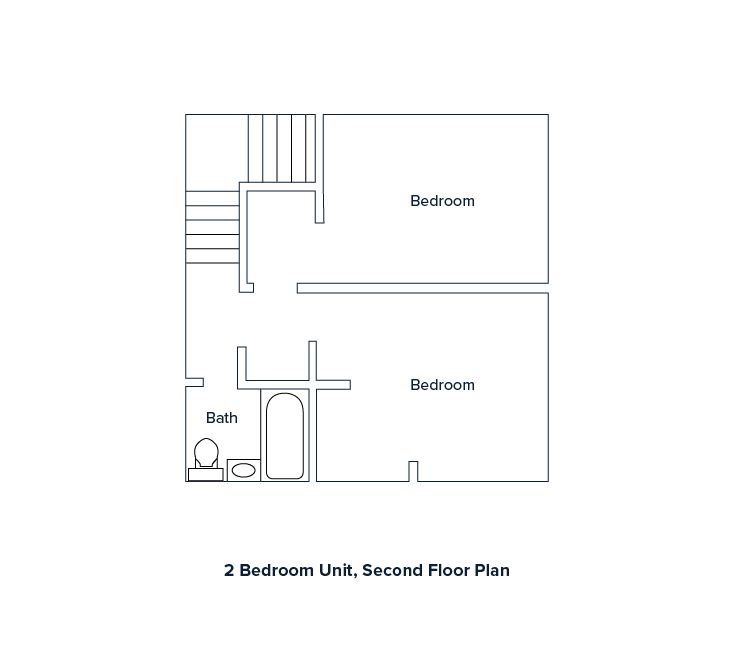
This screenshot has width=734, height=649. In order to click on lower floor in this screenshot , I will do `click(401, 337)`.